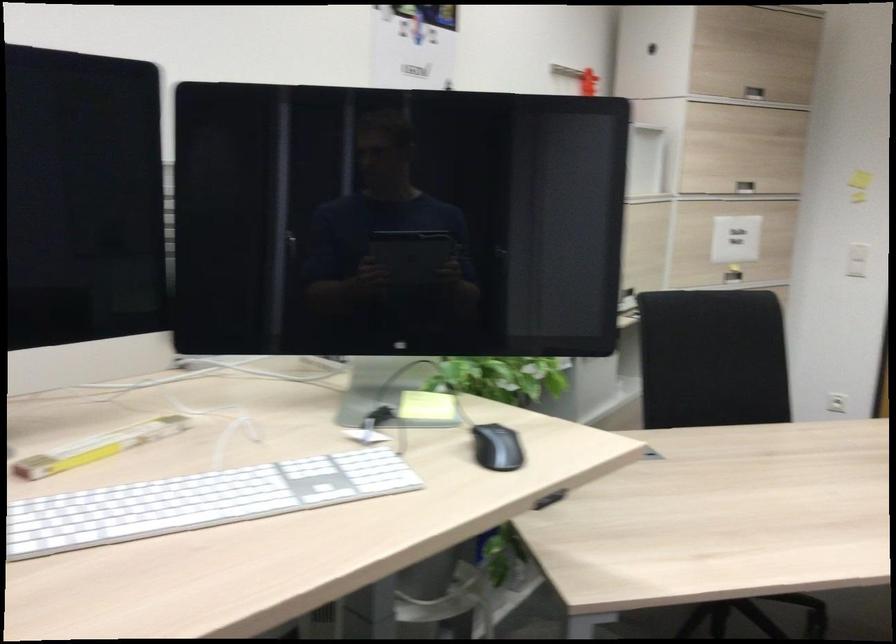
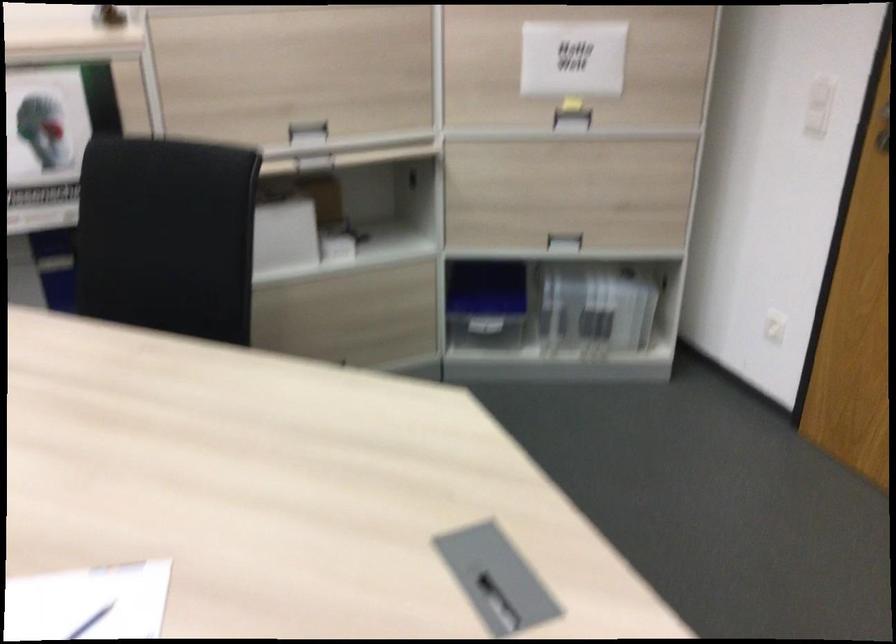
The point at (x=744, y=277) is marked in the first image. Where is the corresponding point in the second image?

(572, 120)